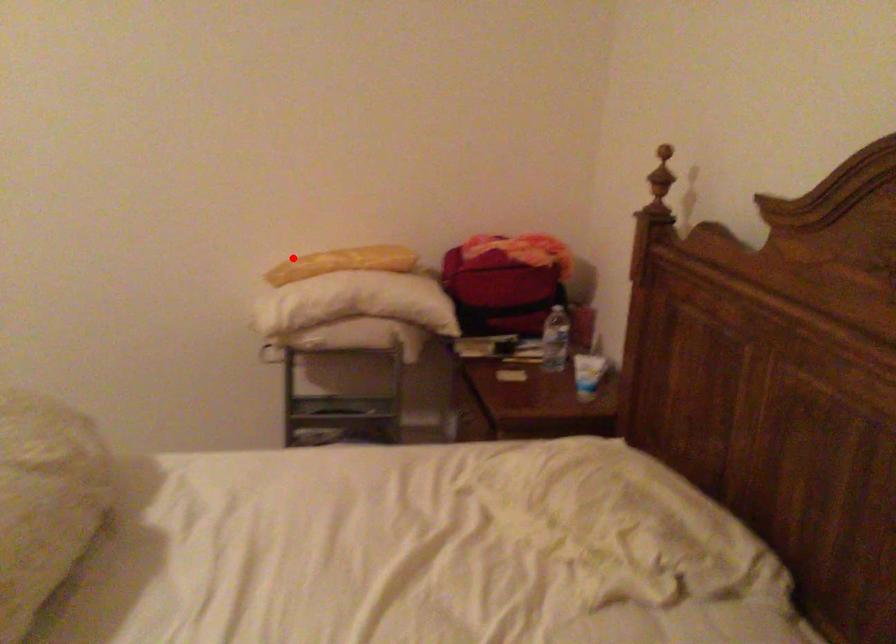
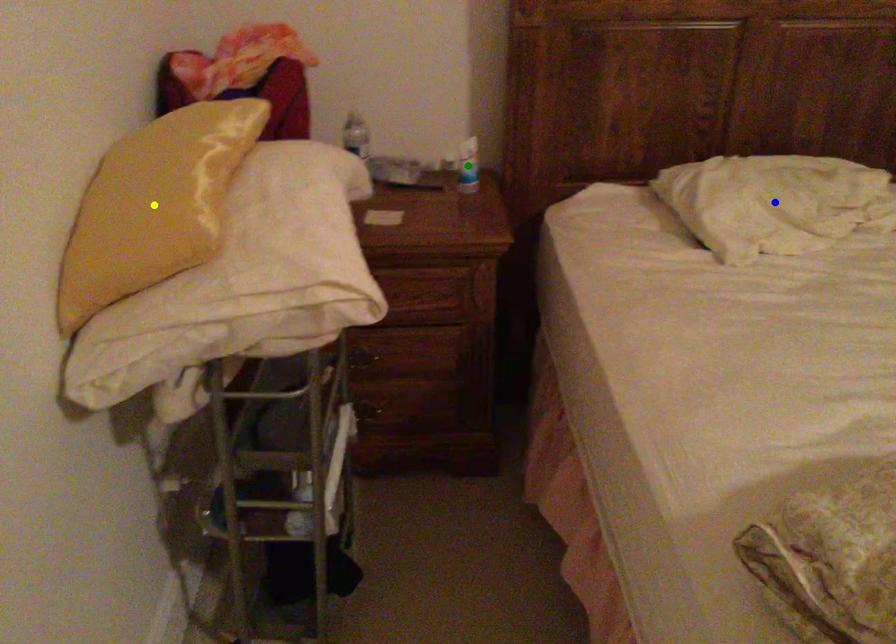
Question: I am providing you with two images of the same scene from different viewpoints. A red point is marked on the first image. You are given multiple points on the second image. Which spot in image 2 lines up with the point in image 1?

Choices:
 (A) blue point
 (B) green point
 (C) yellow point

Answer: (C)